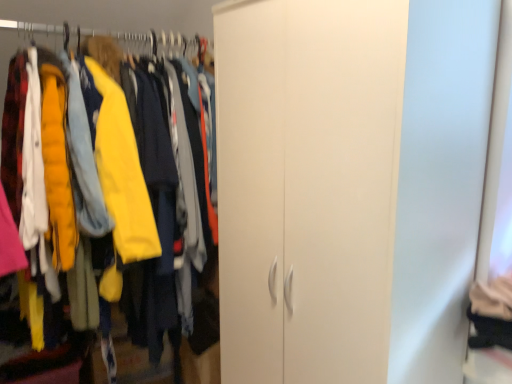
Question: Considering the positions of yellow fabric hanger at upper left and white matte cabinet at center in the image, is yellow fabric hanger at upper left taller or shorter than white matte cabinet at center?

Choices:
 (A) tall
 (B) short

Answer: (B)

Question: Does point (178, 44) appear closer or farther from the camera than point (60, 97)?

Choices:
 (A) closer
 (B) farther

Answer: (B)

Question: Would you say yellow fabric hanger at upper left is inside or outside white matte cabinet at center?

Choices:
 (A) outside
 (B) inside

Answer: (B)

Question: Considering the positions of white matte cabinet at center and yellow fabric hanger at upper left in the image, is white matte cabinet at center bigger or smaller than yellow fabric hanger at upper left?

Choices:
 (A) big
 (B) small

Answer: (A)

Question: From the image's perspective, is white matte cabinet at center above or below yellow fabric hanger at upper left?

Choices:
 (A) above
 (B) below

Answer: (B)

Question: In terms of height, does white matte cabinet at center look taller or shorter compared to yellow fabric hanger at upper left?

Choices:
 (A) tall
 (B) short

Answer: (A)

Question: Considering the positions of point (67, 153) and point (160, 46), is point (67, 153) closer or farther from the camera than point (160, 46)?

Choices:
 (A) farther
 (B) closer

Answer: (B)